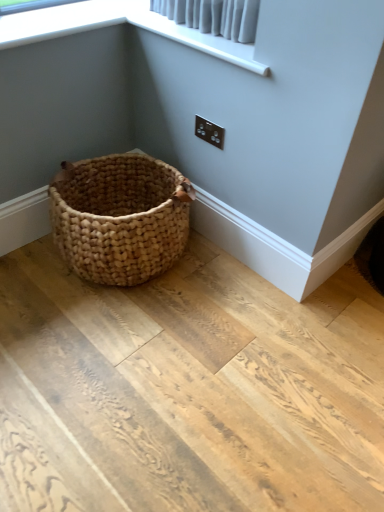
Question: Relative to white fabric at upper center, is black plastic electric outlet at upper right in front or behind?

Choices:
 (A) front
 (B) behind

Answer: (B)

Question: Considering the positions of point (218, 143) and point (94, 5), is point (218, 143) closer or farther from the camera than point (94, 5)?

Choices:
 (A) closer
 (B) farther

Answer: (B)

Question: Looking at their shapes, would you say black plastic electric outlet at upper right is wider or thinner than white fabric at upper center?

Choices:
 (A) thin
 (B) wide

Answer: (A)

Question: Which is correct: white fabric at upper center is inside black plastic electric outlet at upper right, or outside of it?

Choices:
 (A) inside
 (B) outside

Answer: (B)

Question: In terms of width, does white fabric at upper center look wider or thinner when compared to black plastic electric outlet at upper right?

Choices:
 (A) wide
 (B) thin

Answer: (A)

Question: In terms of size, does white fabric at upper center appear bigger or smaller than black plastic electric outlet at upper right?

Choices:
 (A) small
 (B) big

Answer: (B)

Question: Considering the positions of white fabric at upper center and black plastic electric outlet at upper right in the image, is white fabric at upper center taller or shorter than black plastic electric outlet at upper right?

Choices:
 (A) short
 (B) tall

Answer: (A)